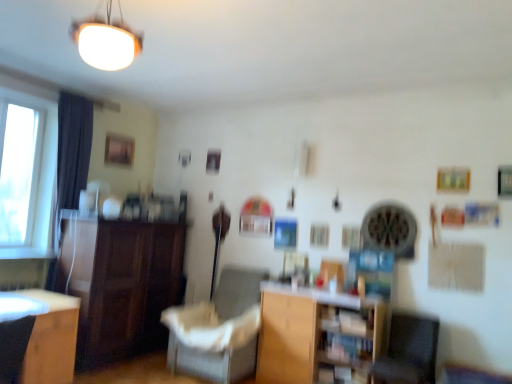
Image resolution: width=512 pixels, height=384 pixels. What do you see at coordinates (45, 333) in the screenshot? I see `wooden desk at lower left` at bounding box center [45, 333].

This screenshot has width=512, height=384. What are the coordinates of `gray fabric swivel chair at lower right` in the screenshot? It's located at (408, 352).

What is the approximate height of white fabric chair at center?

It is 37.38 inches.

Locate an element on the screen. dark gray fabric armchair at lower left is located at coordinates (14, 347).

Locate an element on the screen. wooden at center is located at coordinates (318, 335).

Considering the positions of objects white fabric chair at center and white matte lampshade at upper center in the image provided, who is in front, white fabric chair at center or white matte lampshade at upper center?

white matte lampshade at upper center.

Is white fabric chair at center outside of white matte lampshade at upper center?

Yes, white fabric chair at center is not within white matte lampshade at upper center.

You are a GUI agent. You are given a task and a screenshot of the screen. Output one action in this format:
    pyautogui.click(x=<x>, y=<y>)
    Task: Click on the lamp above the white fabric chair at center (from a real-world perspective)
    The width and height of the screenshot is (512, 384).
    Given the screenshot: What is the action you would take?
    pyautogui.click(x=106, y=41)

Is white fabric chair at center with white matte lampshade at upper center?

They are not placed beside each other.

Which object is thinner, dark gray fabric armchair at lower left or white matte lampshade at upper center?

With smaller width is white matte lampshade at upper center.

Is point (21, 323) closer to viewer compared to point (108, 10)?

That is False.

Are dark gray fabric armchair at lower left and white matte lampshade at upper center far apart?

dark gray fabric armchair at lower left is positioned a significant distance from white matte lampshade at upper center.

From the image's perspective, which is below, dark gray fabric armchair at lower left or white matte lampshade at upper center?

dark gray fabric armchair at lower left is shown below in the image.

From the image's perspective, would you say dark wood cabinet at left is shown under wooden at center?

No, from the image's perspective, dark wood cabinet at left is not below wooden at center.

Considering the positions of objects dark wood cabinet at left and wooden at center in the image provided, who is behind, dark wood cabinet at left or wooden at center?

dark wood cabinet at left is further from the camera.

In the image, there is a dark wood cabinet at left. Where is `shelf below it (from the image's perspective)`? This screenshot has height=384, width=512. shelf below it (from the image's perspective) is located at coordinates (318, 335).

From the image's perspective, is white matte lampshade at upper center on white fabric chair at center?

Indeed, from the image's perspective, white matte lampshade at upper center is shown above white fabric chair at center.

Can you confirm if white matte lampshade at upper center is positioned to the right of white fabric chair at center?

Incorrect, white matte lampshade at upper center is not on the right side of white fabric chair at center.

Can you confirm if white matte lampshade at upper center is taller than white fabric chair at center?

No.

Looking at this image, is white matte lampshade at upper center oriented towards white fabric chair at center?

No, white matte lampshade at upper center is not aimed at white fabric chair at center.

From a real-world perspective, which is physically above, dark wood cabinet at left or white matte lampshade at upper center?

In real-world perspective, white matte lampshade at upper center is above.

From the image's perspective, does dark wood cabinet at left appear higher than white matte lampshade at upper center?

No, from the image's perspective, dark wood cabinet at left is not above white matte lampshade at upper center.

Which is correct: dark wood cabinet at left is inside white matte lampshade at upper center, or outside of it?

dark wood cabinet at left lies outside white matte lampshade at upper center.

How different are the orientations of wooden at center and dark wood cabinet at left in degrees?

There is a 88-degree angle between the facing directions of wooden at center and dark wood cabinet at left.

Is wooden at center aimed at dark wood cabinet at left?

No, wooden at center is not facing towards dark wood cabinet at left.

Considering the positions of objects wooden at center and dark wood cabinet at left in the image provided, who is behind, wooden at center or dark wood cabinet at left?

Positioned behind is dark wood cabinet at left.

Is wooden at center not close to dark wood cabinet at left?

wooden at center is positioned a significant distance from dark wood cabinet at left.

Consider the image. Is gray fabric swivel chair at lower right shorter than dark wood cabinet at left?

Yes.

Which object is wider, gray fabric swivel chair at lower right or dark wood cabinet at left?

dark wood cabinet at left.

Identify the location of cabinetry on the left of gray fabric swivel chair at lower right. The height and width of the screenshot is (384, 512). (120, 284).

Locate an element on the screen. The height and width of the screenshot is (384, 512). lamp located above the white fabric chair at center (from a real-world perspective) is located at coordinates tap(106, 41).

The height and width of the screenshot is (384, 512). In the image, there is a dark gray fabric armchair at lower left. Identify the location of lamp above it (from the image's perspective). (106, 41).

Estimate the real-world distances between objects in this image. Which object is further from wooden at center, gray fabric swivel chair at lower right or white matte lampshade at upper center?

Among the two, white matte lampshade at upper center is located further to wooden at center.

From the image, which object appears to be farther from gray fabric swivel chair at lower right, white fabric chair at center or dark gray fabric armchair at lower left?

The object further to gray fabric swivel chair at lower right is dark gray fabric armchair at lower left.

Looking at this image, based on their spatial positions, is dark wood cabinet at left or white fabric chair at center closer to dark gray fabric armchair at lower left?

dark wood cabinet at left is positioned closer to the anchor dark gray fabric armchair at lower left.

When comparing their distances from white matte lampshade at upper center, does wooden desk at lower left or wooden at center seem closer?

wooden desk at lower left is closer to white matte lampshade at upper center.

From the image, which object appears to be farther from dark gray fabric armchair at lower left, gray fabric swivel chair at lower right or wooden at center?

gray fabric swivel chair at lower right is positioned further to the anchor dark gray fabric armchair at lower left.

Which object lies nearer to the anchor point dark wood cabinet at left, gray fabric swivel chair at lower right or white fabric chair at center?

white fabric chair at center lies closer to dark wood cabinet at left than the other object.

When comparing their distances from white fabric chair at center, does gray fabric swivel chair at lower right or dark gray fabric armchair at lower left seem further?

dark gray fabric armchair at lower left is positioned further to the anchor white fabric chair at center.

Considering their positions, is dark fabric curtain at left positioned further to dark gray fabric armchair at lower left than gray fabric swivel chair at lower right?

gray fabric swivel chair at lower right is further to dark gray fabric armchair at lower left.

The height and width of the screenshot is (384, 512). I want to click on cabinetry between wooden desk at lower left and wooden at center, so pos(120,284).

Where is `chair situated between wooden desk at lower left and wooden at center from left to right`? This screenshot has height=384, width=512. chair situated between wooden desk at lower left and wooden at center from left to right is located at coordinates (223, 323).

Identify the location of desk between dark gray fabric armchair at lower left and dark fabric curtain at left along the z-axis. (45, 333).

Where is `cabinetry between wooden desk at lower left and gray fabric swivel chair at lower right`? The image size is (512, 384). cabinetry between wooden desk at lower left and gray fabric swivel chair at lower right is located at coordinates (120, 284).